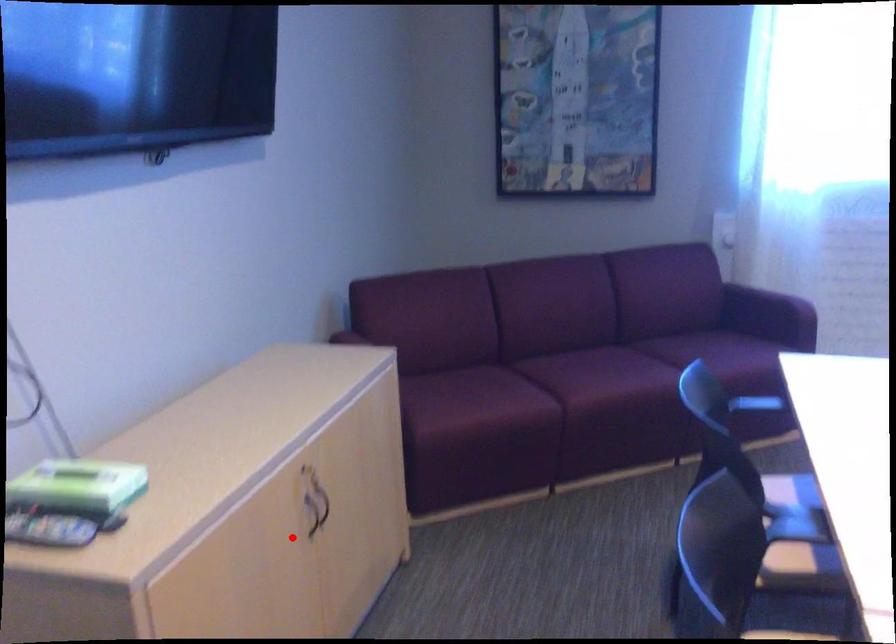
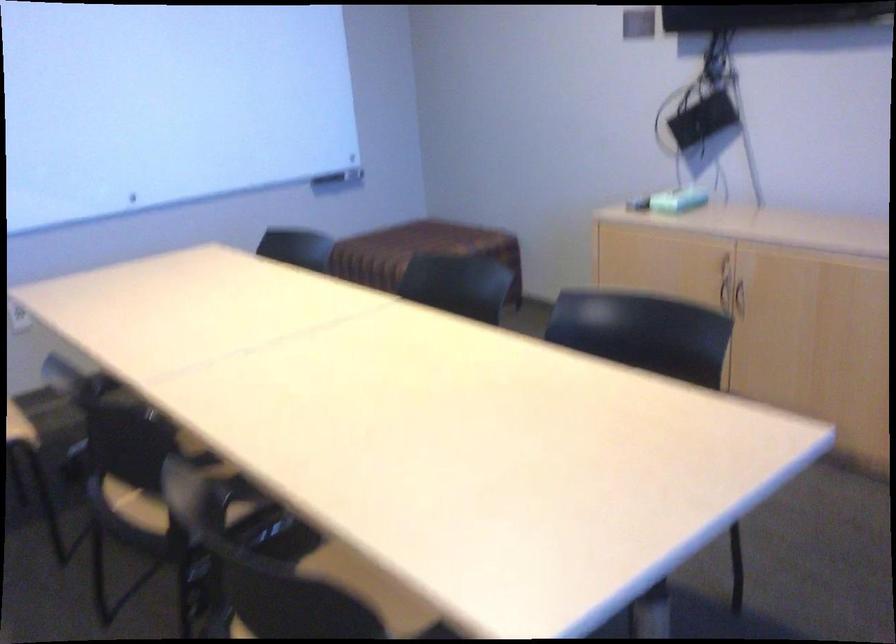
Find the pixel in the second image that matches the highlighted location in the first image.

(725, 295)